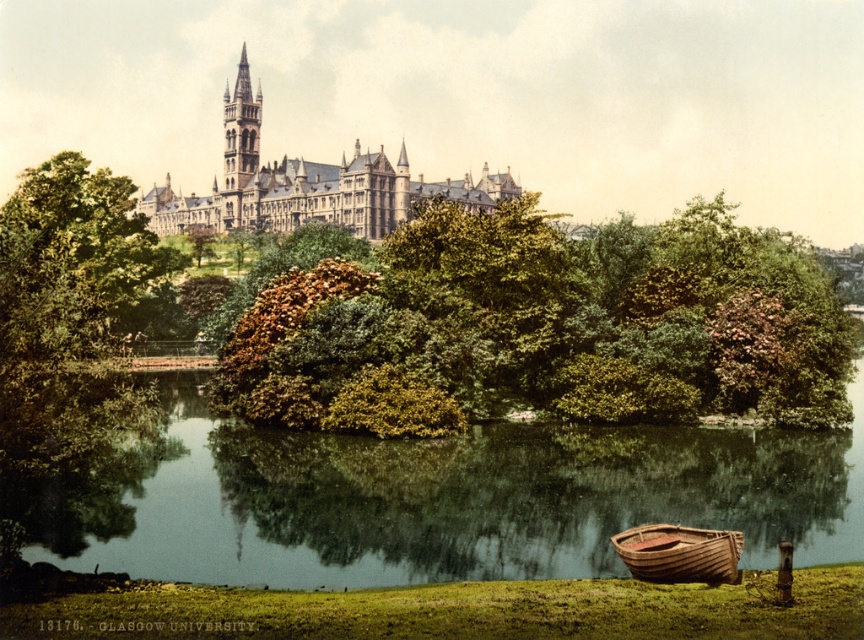
You are a photographer planning to capture the golden stone tower at upper center and the green grassy river at lower center in a single shot. Based on their sizes in the image, which object would appear larger in your photograph?

The green grassy river at lower center might appear larger than the golden stone tower at upper center in the photograph because it is wider according to the description.

You are a landscape architect planning to install a new pathway between the green leafy bush at center and the stone castle at upper center. Considering the distance between them, can a standard wheelchair ramp with a maximum slope of 1 inch per foot be constructed without exceeding the recommended slope for accessibility?

The distance between the green leafy bush at center and the stone castle at upper center is 26.21 meters. To determine if a standard wheelchair ramp with a maximum slope of 1 inch per foot can be constructed, we first convert the distance to feet. 26.21 meters is approximately 86 feet. The recommended slope of 1 inch per foot means that for every foot of horizontal distance, the vertical rise should not exceed 1 inch. Assuming the elevation change between the two points is known, if the vertical difference,